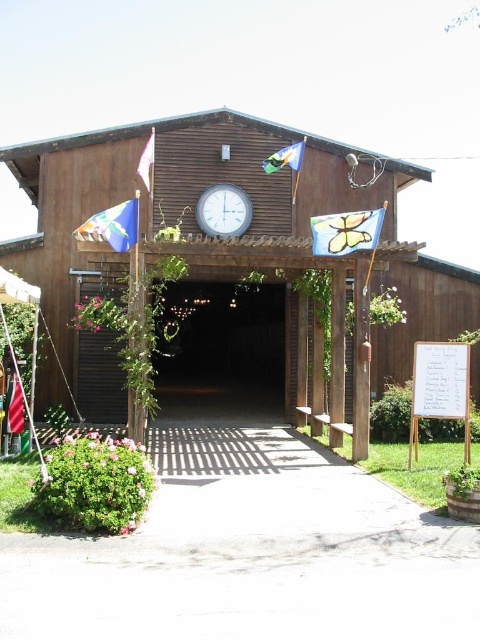
Is brown wooden barn at center to the right of white fabric flag at upper left from the viewer's perspective?

Correct, you'll find brown wooden barn at center to the right of white fabric flag at upper left.

Between brown wooden barn at center and white fabric flag at upper left, which one has less height?

white fabric flag at upper left

Between point (400, 243) and point (153, 138), which one is positioned in front?

Point (400, 243) is more forward.

Locate an element on the screen. brown wooden barn at center is located at coordinates (217, 237).

Based on the photo, can you confirm if black matte door at center is taller than blue fabric flag at left?

Yes.

Does point (113, 413) lie in front of point (124, 220)?

That is False.

Identify the location of black matte door at center. (99, 376).

Does point (362, 228) come farther from viewer compared to point (12, 419)?

No, it is in front of (12, 419).

The image size is (480, 640). Describe the element at coordinates (346, 232) in the screenshot. I see `butterfly fabric flag at center` at that location.

Which is behind, point (324, 246) or point (12, 387)?

Point (12, 387)

Find the location of a particular element. butterfly fabric flag at center is located at coordinates (346, 232).